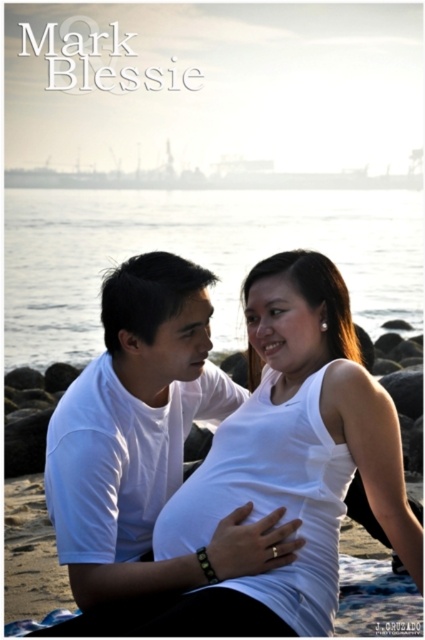
Question: Does white smooth tank top at center have a lesser width compared to clear water at center?

Choices:
 (A) yes
 (B) no

Answer: (A)

Question: Which point is farther to the camera?

Choices:
 (A) pyautogui.click(x=85, y=237)
 (B) pyautogui.click(x=365, y=486)
 (C) pyautogui.click(x=119, y=595)

Answer: (A)

Question: Based on their relative distances, which object is nearer to the clear water at center?

Choices:
 (A) white matte t-shirt at center
 (B) white smooth tank top at center

Answer: (B)

Question: In this image, where is white matte t-shirt at center located relative to white smooth tank top at center?

Choices:
 (A) left
 (B) right

Answer: (A)

Question: Does white smooth tank top at center have a smaller size compared to clear water at center?

Choices:
 (A) no
 (B) yes

Answer: (B)

Question: Among these objects, which one is nearest to the camera?

Choices:
 (A) clear water at center
 (B) white matte t-shirt at center
 (C) white smooth tank top at center

Answer: (C)